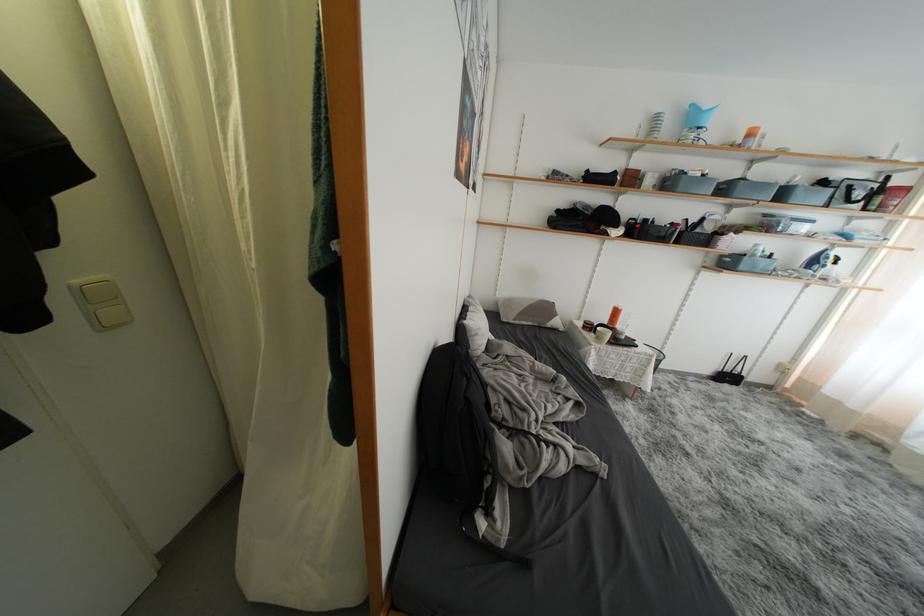
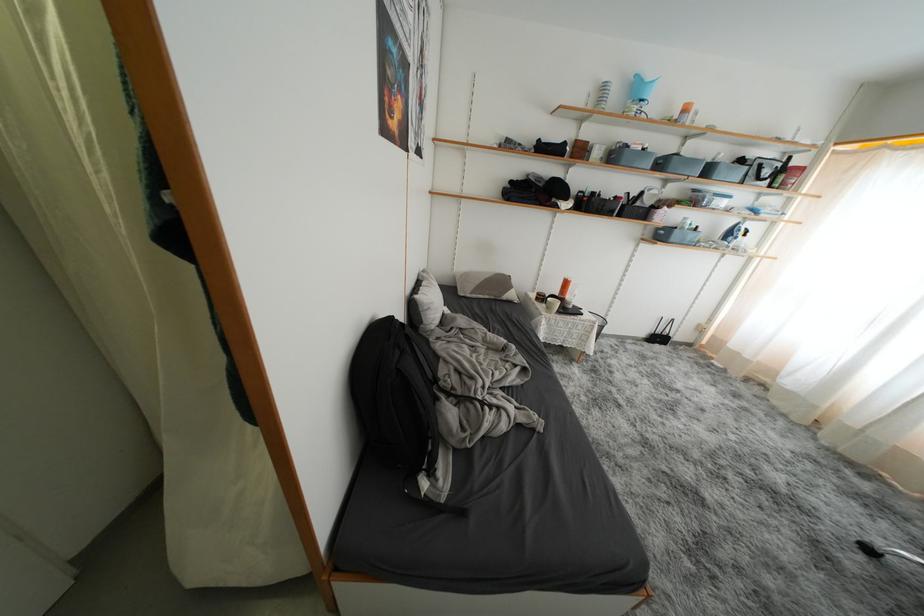
Where in the second image is the point corresponding to point 789,199 from the first image?

(714, 175)